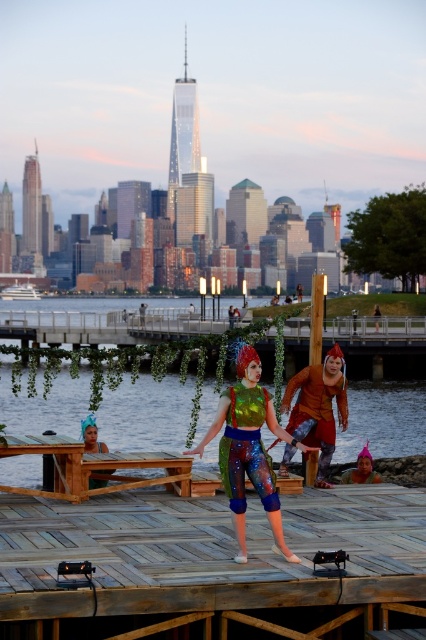
Question: Does shiny metallic top at center have a larger size compared to orange fabric costume at right?

Choices:
 (A) no
 (B) yes

Answer: (B)

Question: Can you confirm if shiny metallic top at center is positioned to the right of metallic silver helmet at center?

Choices:
 (A) no
 (B) yes

Answer: (B)

Question: Which point appears closest to the camera in this image?

Choices:
 (A) (94, 440)
 (B) (365, 467)
 (C) (333, 433)
 (D) (385, 444)

Answer: (C)

Question: Can you confirm if shiny metallic top at center is positioned to the left of orange fabric costume at right?

Choices:
 (A) yes
 (B) no

Answer: (A)

Question: Which point appears closest to the camera in this image?

Choices:
 (A) (161, 396)
 (B) (230, 616)

Answer: (B)

Question: Which of the following is the farthest from the observer?

Choices:
 (A) matte pink swim cap at lower right
 (B) wooden dock at center

Answer: (A)